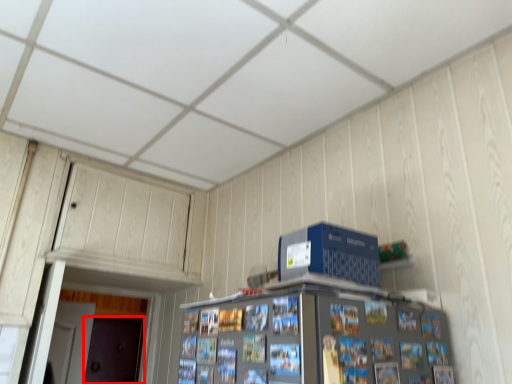
Question: In this image, where is door (annotated by the red box) located relative to computer?

Choices:
 (A) right
 (B) left

Answer: (B)